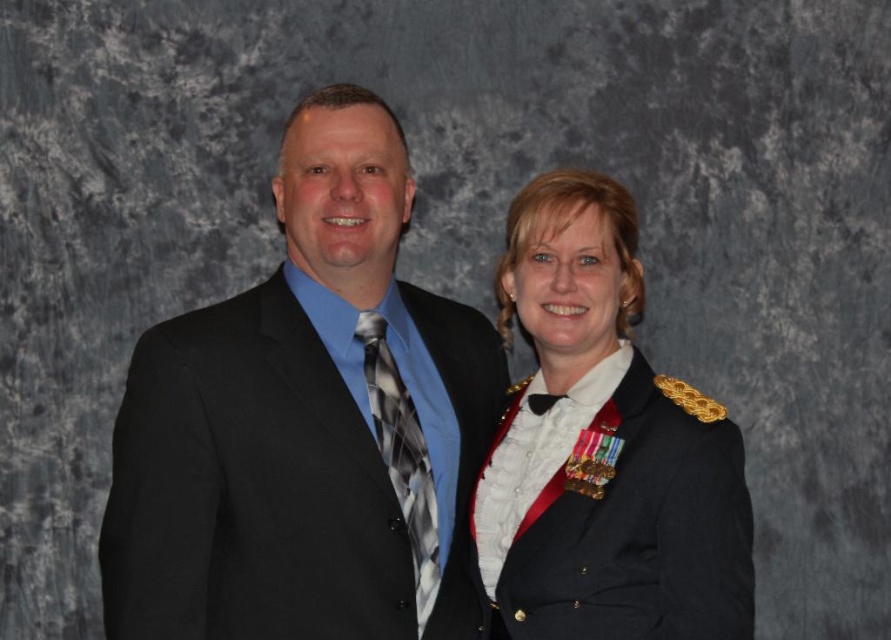
From the picture: Who is more forward, (415, 499) or (552, 330)?

Point (415, 499) is more forward.

From the picture: Does black suit at left appear on the right side of shiny black uniform at center?

Incorrect, black suit at left is not on the right side of shiny black uniform at center.

Describe the element at coordinates (305, 424) in the screenshot. I see `black suit at left` at that location.

At what (x,y) coordinates should I click in order to perform the action: click on black suit at left. Please return your answer as a coordinate pair (x, y). The image size is (891, 640). Looking at the image, I should click on (305, 424).

Can you confirm if shiny black uniform at center is thinner than plaid silk tie at center?

In fact, shiny black uniform at center might be wider than plaid silk tie at center.

Who is lower down, shiny black uniform at center or plaid silk tie at center?

plaid silk tie at center

Who is more forward, (721, 620) or (409, 497)?

Positioned in front is point (721, 620).

At what (x,y) coordinates should I click in order to perform the action: click on shiny black uniform at center. Please return your answer as a coordinate pair (x, y). The width and height of the screenshot is (891, 640). Looking at the image, I should click on (603, 449).

How distant is black suit at left from plaid silk tie at center?

black suit at left is 5.35 inches from plaid silk tie at center.

Between black suit at left and plaid silk tie at center, which one has more height?

Standing taller between the two is black suit at left.

What do you see at coordinates (305, 424) in the screenshot? The height and width of the screenshot is (640, 891). I see `black suit at left` at bounding box center [305, 424].

This screenshot has width=891, height=640. In order to click on black suit at left in this screenshot , I will do `click(305, 424)`.